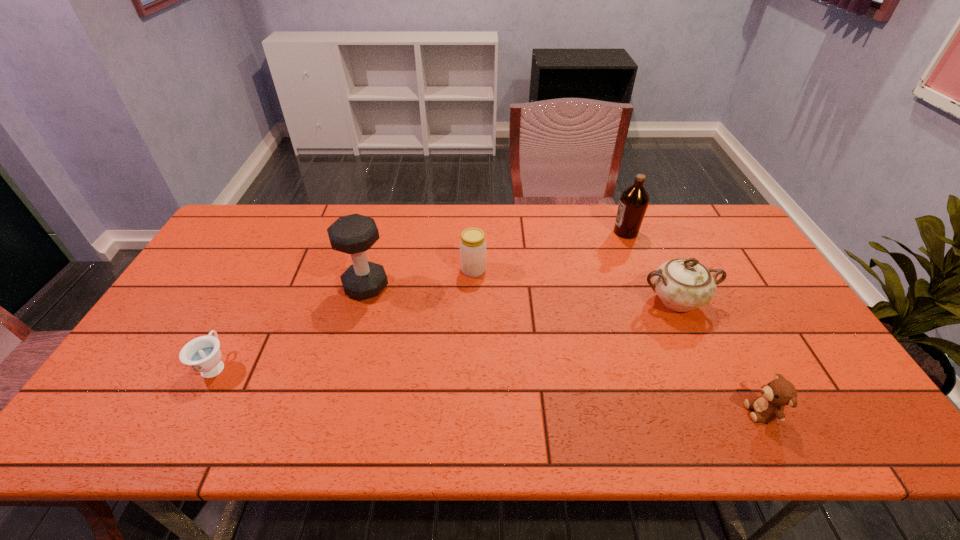
Where is `blank area in the image that satisfies the following two spatial constraints: 1. on the label of the farthest object; 2. on the right side of the chinaware`? This screenshot has height=540, width=960. blank area in the image that satisfies the following two spatial constraints: 1. on the label of the farthest object; 2. on the right side of the chinaware is located at coordinates tap(653, 301).

Find the location of a particular element. vacant region that satisfies the following two spatial constraints: 1. on the label of the farthest object; 2. on the back side of the fourth shortest object is located at coordinates (653, 301).